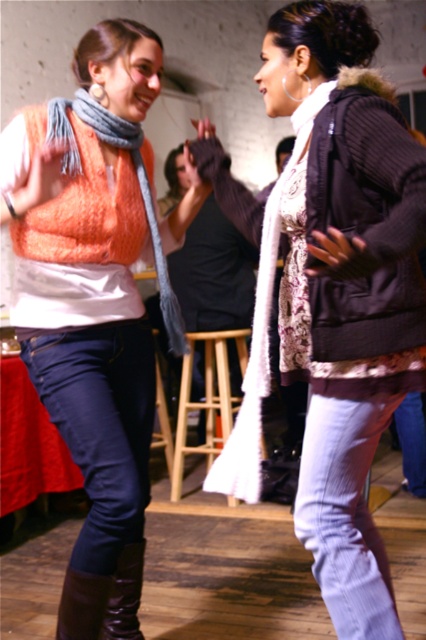
You are standing in the room and want to locate the knitted gray scarf at left. According to the scene description, where exactly is it positioned?

The knitted gray scarf at left is located at point (138, 180).

Consider the image. You are a photographer trying to capture a candid shot of the two people in the image. You want to ensure that both the knitted gray scarf at left and the leather boot at lower left are visible in the frame. Based on their positions, can you confirm if the scarf is positioned higher than the boot?

The knitted gray scarf at left is located above the leather boot at lower left, so yes, the scarf is positioned higher than the boot in the image.